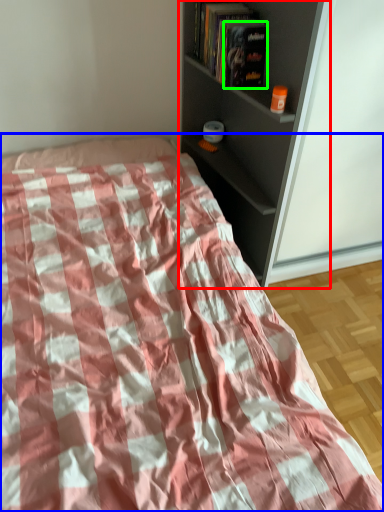
Question: Based on their relative distances, which object is nearer to shelf (highlighted by a red box)? Choose from bed (highlighted by a blue box) and paperback book (highlighted by a green box).

Choices:
 (A) bed
 (B) paperback book

Answer: (B)